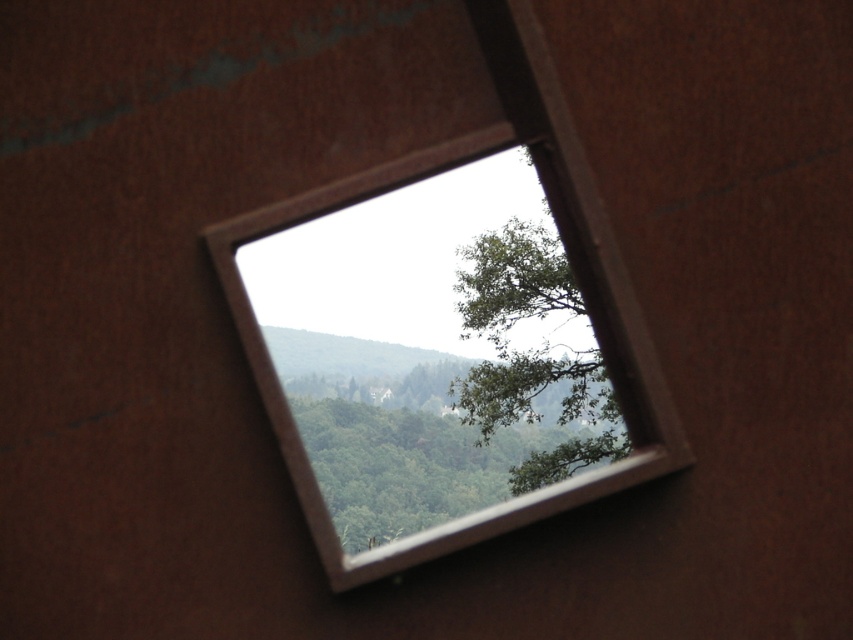
You are an architect designing a new building and want to ensure the metallic silver window frame at center allows a view of the green leafy tree at upper center. Based on their sizes, will the window frame block the view of the tree?

The metallic silver window frame at center is much taller than the green leafy tree at upper center, so the window frame will block the view of the tree.

In the scene shown: You are an interior designer assessing the view from a room. You notice the metallic silver window frame at center and the green leafy tree at upper center. Which object takes up more space in the scene?

The metallic silver window frame at center is larger in size than the green leafy tree at upper center, so it takes up more space in the scene.

Based on the photo, you are standing in a room with a view of a green leafy tree at upper center and a metallic silver window frame at center. Which object is positioned to the left of the other?

The metallic silver window frame at center is positioned to the left of the green leafy tree at upper center.